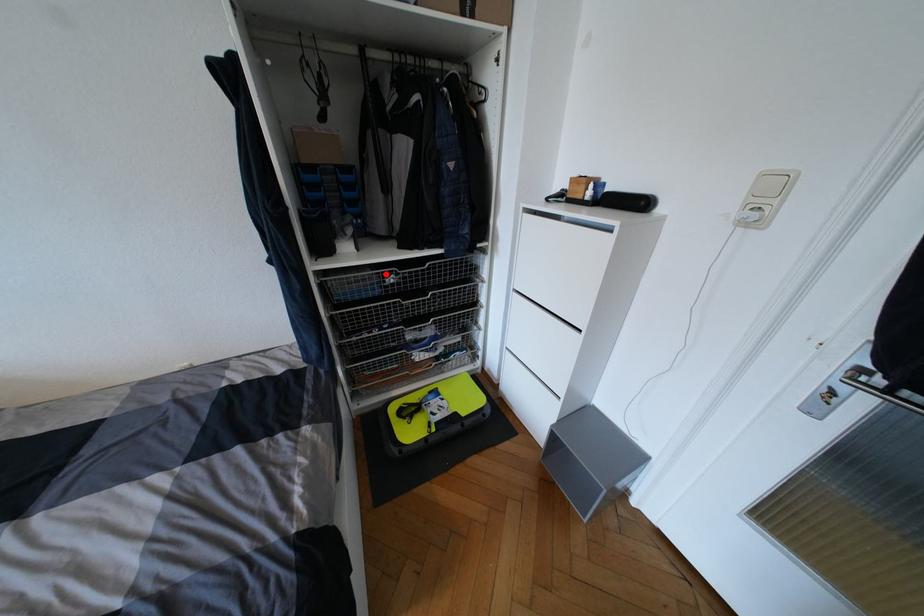
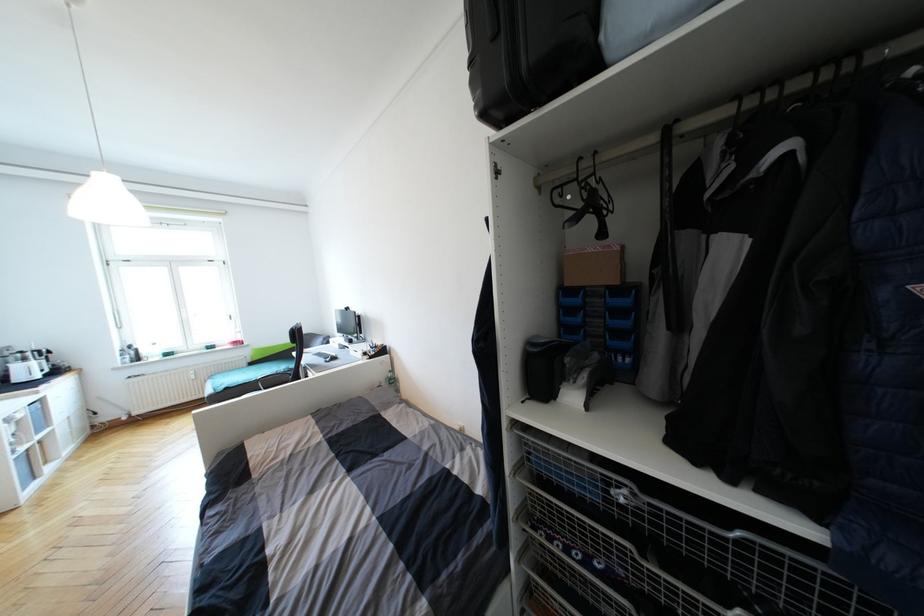
Where in the second image is the point corresponding to the highlighted location from the first image?

(604, 476)